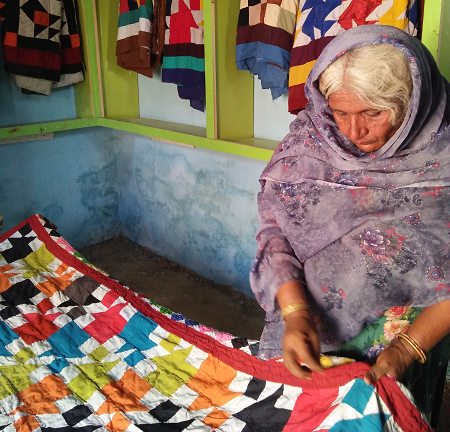
This screenshot has width=450, height=432. Identify the location of quilt. 215,389.